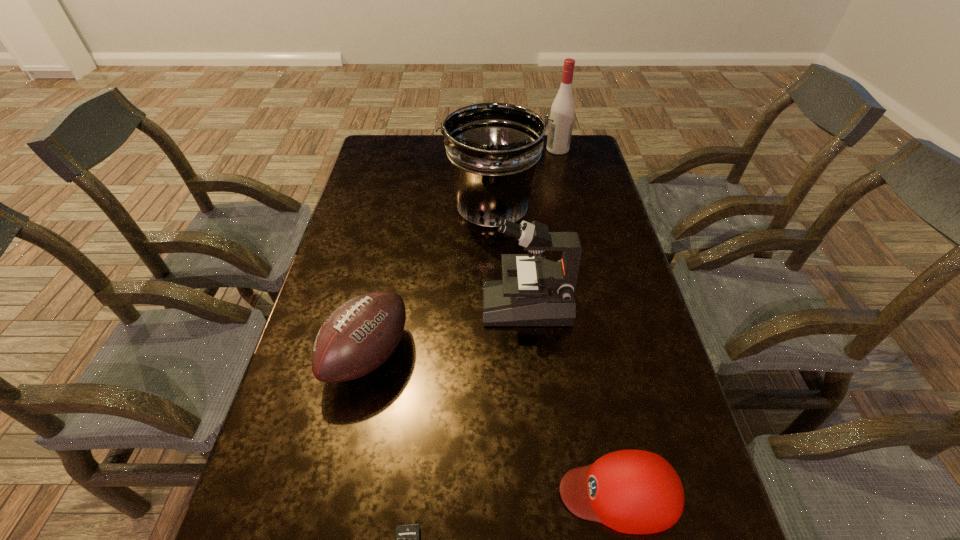
Locate an element on the screen. baseball cap positioned at the right edge is located at coordinates (630, 491).

Find the location of `object located at the far right corner`. object located at the far right corner is located at coordinates (562, 112).

This screenshot has width=960, height=540. In the image, there is a desktop. In order to click on free space at the left edge in this screenshot , I will do `click(344, 383)`.

In the image, there is a desktop. Identify the location of free space at the right edge. Image resolution: width=960 pixels, height=540 pixels. (592, 170).

You are a GUI agent. You are given a task and a screenshot of the screen. Output one action in this format:
    pyautogui.click(x=<x>, y=<y>)
    Task: Click on the vacant space at the far left corner of the desktop
    This screenshot has width=960, height=540.
    Given the screenshot: What is the action you would take?
    click(409, 150)

I want to click on free space between the microscope and the football (American), so click(x=447, y=330).

This screenshot has height=540, width=960. I want to click on vacant point located between the fifth tallest object and the farthest object, so click(x=588, y=321).

At what (x,y) coordinates should I click in order to perform the action: click on vacant space that's between the fifth tallest object and the microscope. Please return your answer as a coordinate pair (x, y). The image size is (960, 540). Looking at the image, I should click on (573, 399).

Locate an element on the screen. This screenshot has height=540, width=960. free space that is in between the fifth nearest object and the baseball cap is located at coordinates (556, 353).

Where is `unoccupied position between the fourth tallest object and the farthest object`? unoccupied position between the fourth tallest object and the farthest object is located at coordinates (463, 253).